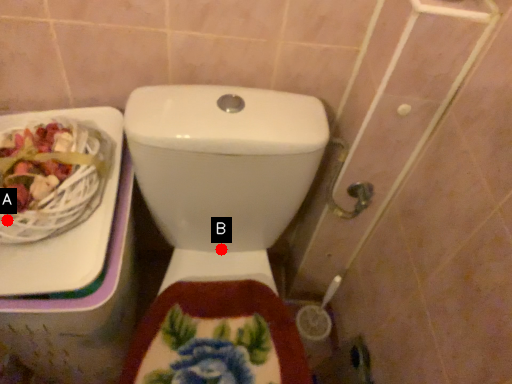
Question: Two points are circled on the image, labeled by A and B beside each circle. Which of the following is the closest to the observer?

Choices:
 (A) A is closer
 (B) B is closer

Answer: (A)